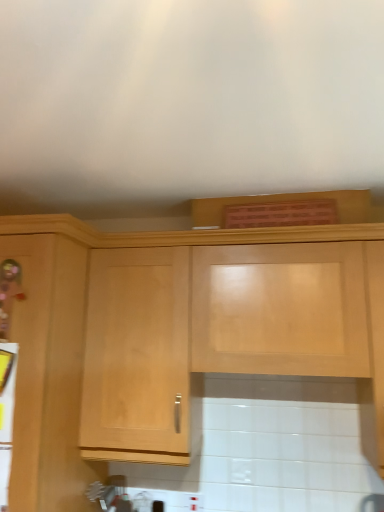
Where is `metallic silver toaster at lower left`? metallic silver toaster at lower left is located at coordinates (6, 415).

What is the approximate height of metallic silver toaster at lower left?

It is 11.75 inches.

The height and width of the screenshot is (512, 384). What do you see at coordinates (6, 415) in the screenshot?
I see `metallic silver toaster at lower left` at bounding box center [6, 415].

In order to click on light wood cabinet at upper center in this screenshot , I will do `click(172, 335)`.

What do you see at coordinates (172, 335) in the screenshot? I see `light wood cabinet at upper center` at bounding box center [172, 335].

Where is `metallic silver toaster at lower left`? Image resolution: width=384 pixels, height=512 pixels. metallic silver toaster at lower left is located at coordinates (6, 415).

Consider the image. Is metallic silver toaster at lower left to the right of light wood cabinet at upper center from the viewer's perspective?

Incorrect, metallic silver toaster at lower left is not on the right side of light wood cabinet at upper center.

Which object is closer to the camera, metallic silver toaster at lower left or light wood cabinet at upper center?

light wood cabinet at upper center is more forward.

Considering the points (4, 349) and (53, 496), which point is behind, point (4, 349) or point (53, 496)?

Positioned behind is point (53, 496).

From the image's perspective, who appears lower, metallic silver toaster at lower left or light wood cabinet at upper center?

metallic silver toaster at lower left, from the image's perspective.

From a real-world perspective, is metallic silver toaster at lower left located higher than light wood cabinet at upper center?

No.

Considering the relative sizes of metallic silver toaster at lower left and light wood cabinet at upper center in the image provided, is metallic silver toaster at lower left wider than light wood cabinet at upper center?

No, metallic silver toaster at lower left is not wider than light wood cabinet at upper center.

Between metallic silver toaster at lower left and light wood cabinet at upper center, which one has less height?

metallic silver toaster at lower left.

Considering the relative sizes of metallic silver toaster at lower left and light wood cabinet at upper center in the image provided, is metallic silver toaster at lower left smaller than light wood cabinet at upper center?

Yes.

Is metallic silver toaster at lower left outside of light wood cabinet at upper center?

Yes, metallic silver toaster at lower left is located beyond the bounds of light wood cabinet at upper center.

Is metallic silver toaster at lower left placed right next to light wood cabinet at upper center?

No, metallic silver toaster at lower left is not touching light wood cabinet at upper center.

Is metallic silver toaster at lower left oriented towards light wood cabinet at upper center?

No, metallic silver toaster at lower left is not turned towards light wood cabinet at upper center.

Locate an element on the screen. cabinetry above the metallic silver toaster at lower left (from a real-world perspective) is located at coordinates (172, 335).

Which object is positioned more to the left, light wood cabinet at upper center or metallic silver toaster at lower left?

From the viewer's perspective, metallic silver toaster at lower left appears more on the left side.

In the image, is light wood cabinet at upper center positioned in front of or behind metallic silver toaster at lower left?

In the image, light wood cabinet at upper center appears in front of metallic silver toaster at lower left.

Which is closer, (171, 359) or (15, 376)?

Point (171, 359) is farther from the camera than point (15, 376).

From the image's perspective, which is above, light wood cabinet at upper center or metallic silver toaster at lower left?

From the image's view, light wood cabinet at upper center is above.

From a real-world perspective, relative to metallic silver toaster at lower left, is light wood cabinet at upper center vertically above or below?

light wood cabinet at upper center is above metallic silver toaster at lower left.

Is light wood cabinet at upper center thinner than metallic silver toaster at lower left?

No, light wood cabinet at upper center is not thinner than metallic silver toaster at lower left.

Who is shorter, light wood cabinet at upper center or metallic silver toaster at lower left?

Standing shorter between the two is metallic silver toaster at lower left.

Can you confirm if light wood cabinet at upper center is smaller than metallic silver toaster at lower left?

Actually, light wood cabinet at upper center might be larger than metallic silver toaster at lower left.

Would you say light wood cabinet at upper center is outside metallic silver toaster at lower left?

Absolutely, light wood cabinet at upper center is external to metallic silver toaster at lower left.

Is light wood cabinet at upper center touching metallic silver toaster at lower left?

No, light wood cabinet at upper center is not with metallic silver toaster at lower left.

Is light wood cabinet at upper center aimed at metallic silver toaster at lower left?

No.

The width and height of the screenshot is (384, 512). I want to click on cabinetry above the metallic silver toaster at lower left (from a real-world perspective), so click(x=172, y=335).

At what (x,y) coordinates should I click in order to perform the action: click on cabinetry in front of the metallic silver toaster at lower left. Please return your answer as a coordinate pair (x, y). The image size is (384, 512). Looking at the image, I should click on (172, 335).

Where is `appliance on the left of light wood cabinet at upper center`? This screenshot has width=384, height=512. appliance on the left of light wood cabinet at upper center is located at coordinates [6, 415].